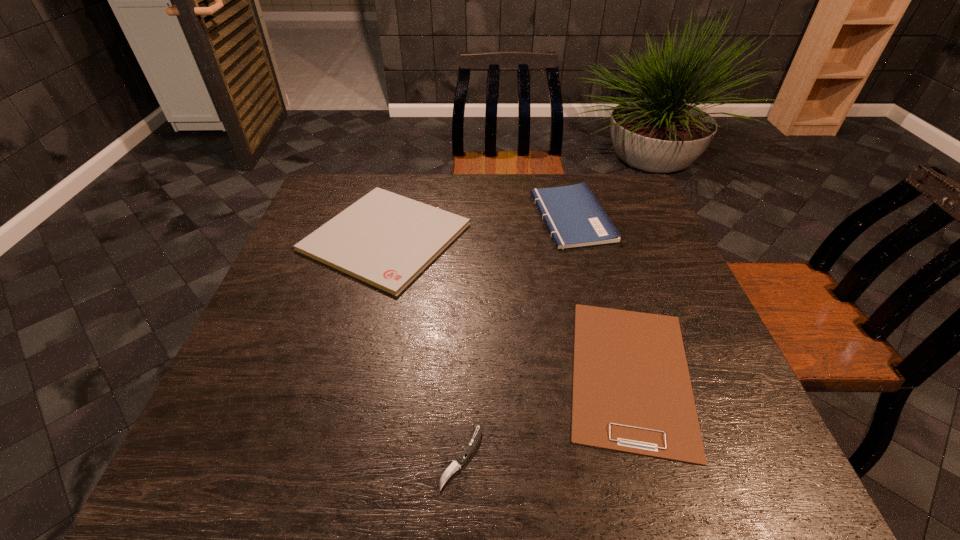
Find the location of a particular element. This screenshot has width=960, height=540. vacant area that lies between the shorter clipboard and the pocketknife is located at coordinates (546, 415).

Where is `vacant area that lies between the paperback book and the nearer clipboard`? The height and width of the screenshot is (540, 960). vacant area that lies between the paperback book and the nearer clipboard is located at coordinates (601, 295).

I want to click on free spot between the farther clipboard and the tallest object, so click(479, 227).

At what (x,y) coordinates should I click in order to perform the action: click on free spot between the pocketknife and the tallest object. Please return your answer as a coordinate pair (x, y). The width and height of the screenshot is (960, 540). Looking at the image, I should click on (516, 336).

Where is `vacant space that is in between the nearer clipboard and the pocketknife`? The width and height of the screenshot is (960, 540). vacant space that is in between the nearer clipboard and the pocketknife is located at coordinates (546, 415).

Locate which object ranks in proximity to the nearer clipboard. Please provide its 2D coordinates. Your answer should be formatted as a tuple, i.e. [(x, y)], where the tuple contains the x and y coordinates of a point satisfying the conditions above.

[(471, 445)]

The width and height of the screenshot is (960, 540). I want to click on the closest object to the right clipboard, so click(x=471, y=445).

At what (x,y) coordinates should I click in order to perform the action: click on free space that satisfies the following two spatial constraints: 1. on the front side of the paperback book; 2. on the right side of the nearer clipboard. Please return your answer as a coordinate pair (x, y). Looking at the image, I should click on 612,373.

This screenshot has width=960, height=540. I want to click on blank space that satisfies the following two spatial constraints: 1. on the back side of the pocketknife; 2. on the right side of the paperback book, so click(468, 217).

Image resolution: width=960 pixels, height=540 pixels. Find the location of `vacant position in the image that satisfies the following two spatial constraints: 1. on the back side of the nearer clipboard; 2. on the left side of the pocketknife`. vacant position in the image that satisfies the following two spatial constraints: 1. on the back side of the nearer clipboard; 2. on the left side of the pocketknife is located at coordinates (464, 373).